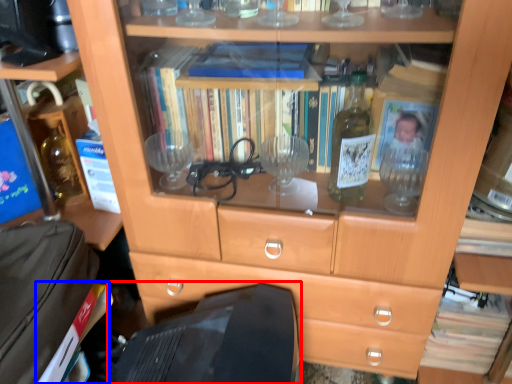
Question: Which point is further to the camera, computer monitor (highlighted by a red box) or paperback book (highlighted by a blue box)?

Choices:
 (A) computer monitor
 (B) paperback book

Answer: (B)